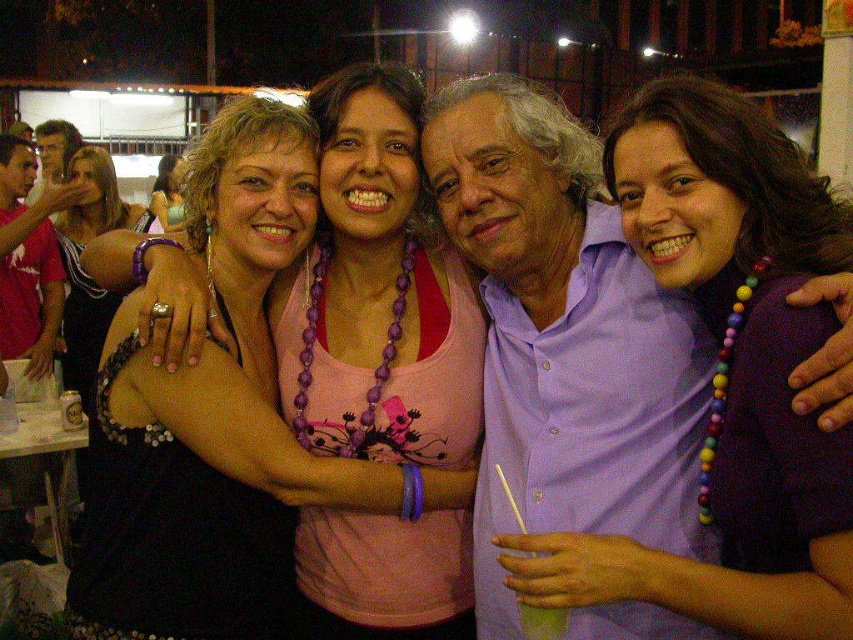
Based on the photo, you are trying to take a photo of the matte black dress at center but the matte black dress at left is blocking your view. Can you move around to the right side to get a clear shot?

The matte black dress at left is in front of the matte black dress at center, so moving to the right side might allow you to see around the matte black dress at left and get a clear view of the matte black dress at center.

You are trying to decide which outfit to choose for a party. You see the pink fabric tank top at center and the matte black dress at center in the image. Which one is narrower?

The pink fabric tank top at center is narrower than the matte black dress at center.